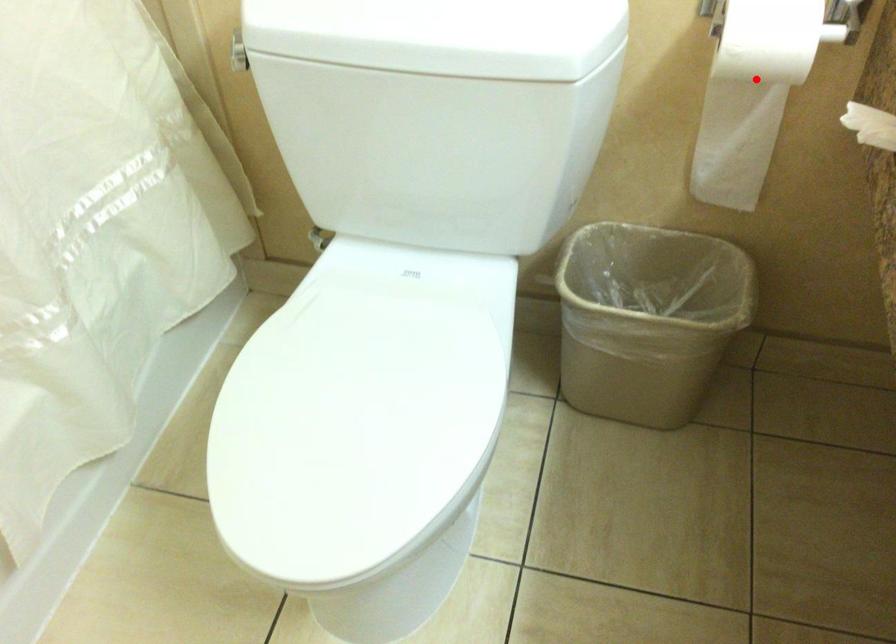
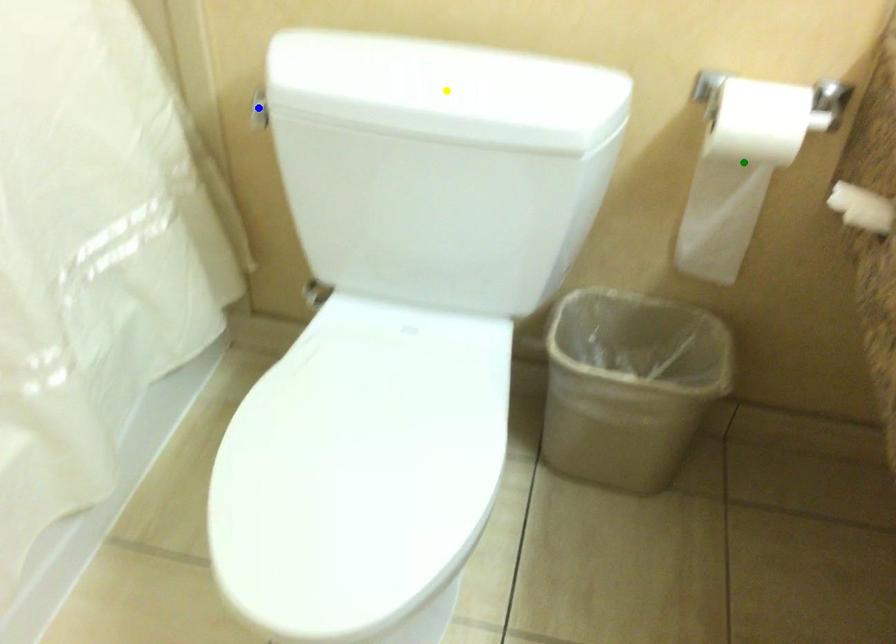
Question: I am providing you with two images of the same scene from different viewpoints. A red point is marked on the first image. You are given multiple points on the second image. Which point in image 2 is actually the same real-world point as the red point in image 1?

Choices:
 (A) yellow point
 (B) blue point
 (C) green point

Answer: (C)